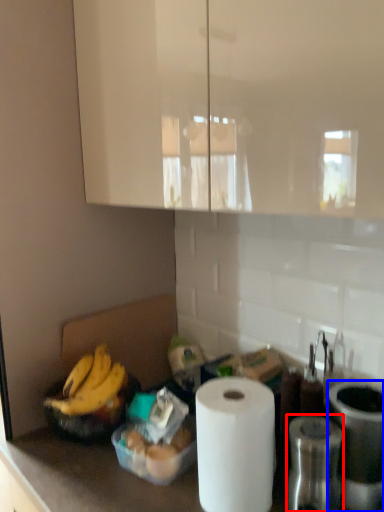
Question: Which object appears closest to the camera in this image, appliance (highlighted by a red box) or appliance (highlighted by a blue box)?

Choices:
 (A) appliance
 (B) appliance

Answer: (A)